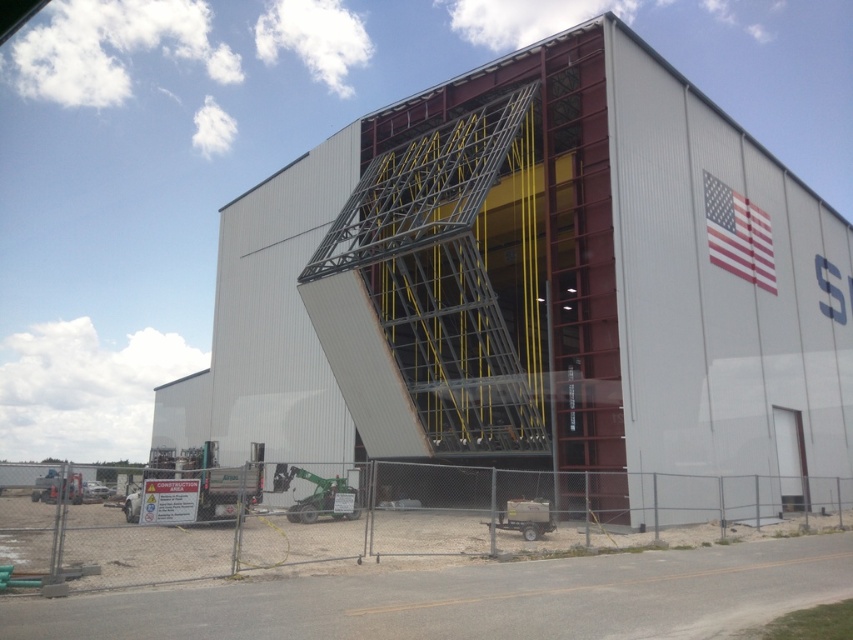
Question: Does metal fence at lower center have a smaller size compared to american flag at upper right?

Choices:
 (A) yes
 (B) no

Answer: (B)

Question: Based on their relative distances, which object is nearer to the metal fence at lower center?

Choices:
 (A) american flag at upper right
 (B) metallic gray hangar at center

Answer: (B)

Question: Which point is farther from the camera taking this photo?

Choices:
 (A) (724, 241)
 (B) (730, 605)
 (C) (631, 138)

Answer: (A)

Question: Does metal fence at lower center have a lesser width compared to american flag at upper right?

Choices:
 (A) no
 (B) yes

Answer: (A)

Question: Does metallic gray hangar at center have a larger size compared to metal fence at lower center?

Choices:
 (A) no
 (B) yes

Answer: (B)

Question: Considering the real-world distances, which object is closest to the metallic gray hangar at center?

Choices:
 (A) american flag at upper right
 (B) metal fence at lower center

Answer: (B)